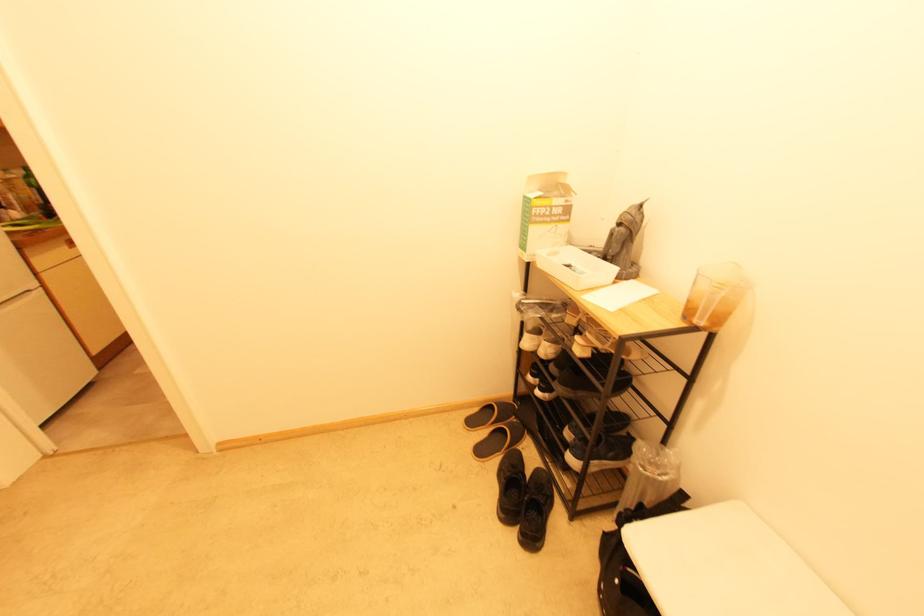
Which object does [544,213] point to?

It corresponds to the cardboard mask box in the image.